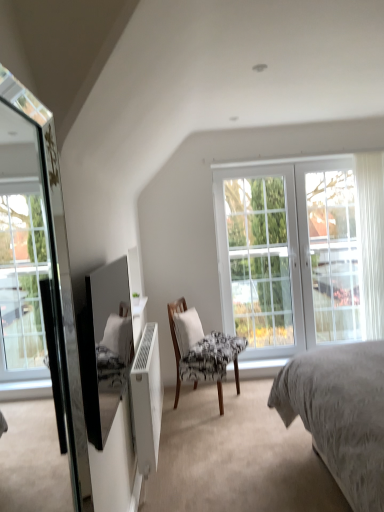
Question: Should I look upward or downward to see wooden chair with patterned fabric at center?

Choices:
 (A) up
 (B) down

Answer: (B)

Question: From a real-world perspective, is white glass window at center, the second window viewed from the left, under wooden chair with patterned fabric at center?

Choices:
 (A) yes
 (B) no

Answer: (B)

Question: Does white glass window at center, the second window viewed from the left, come in front of wooden chair with patterned fabric at center?

Choices:
 (A) yes
 (B) no

Answer: (B)

Question: From a real-world perspective, is white glass window at center, the second window viewed from the left, located higher than wooden chair with patterned fabric at center?

Choices:
 (A) no
 (B) yes

Answer: (B)

Question: Considering the relative sizes of white glass window at center, the first window when ordered from right to left, and wooden chair with patterned fabric at center in the image provided, is white glass window at center, the first window when ordered from right to left, wider than wooden chair with patterned fabric at center?

Choices:
 (A) no
 (B) yes

Answer: (A)

Question: Does white glass window at center, the first window when ordered from right to left, have a smaller size compared to wooden chair with patterned fabric at center?

Choices:
 (A) yes
 (B) no

Answer: (B)

Question: Does white glass window at center, the second window viewed from the left, contain wooden chair with patterned fabric at center?

Choices:
 (A) no
 (B) yes

Answer: (A)

Question: Considering the relative positions of white fabric pillow at center and white glass screen door at right in the image provided, is white fabric pillow at center to the right of white glass screen door at right from the viewer's perspective?

Choices:
 (A) no
 (B) yes

Answer: (A)

Question: Does white fabric pillow at center have a greater height compared to white glass screen door at right?

Choices:
 (A) no
 (B) yes

Answer: (A)

Question: Is white fabric pillow at center outside white glass screen door at right?

Choices:
 (A) no
 (B) yes

Answer: (B)

Question: Is white fabric pillow at center closer to camera compared to white glass screen door at right?

Choices:
 (A) yes
 (B) no

Answer: (A)

Question: Is white fabric pillow at center smaller than white glass screen door at right?

Choices:
 (A) no
 (B) yes

Answer: (B)

Question: Are white fabric pillow at center and white glass screen door at right far apart?

Choices:
 (A) yes
 (B) no

Answer: (A)

Question: Is white glass screen door at right not within white glass window at center, the second window viewed from the left?

Choices:
 (A) no
 (B) yes

Answer: (A)